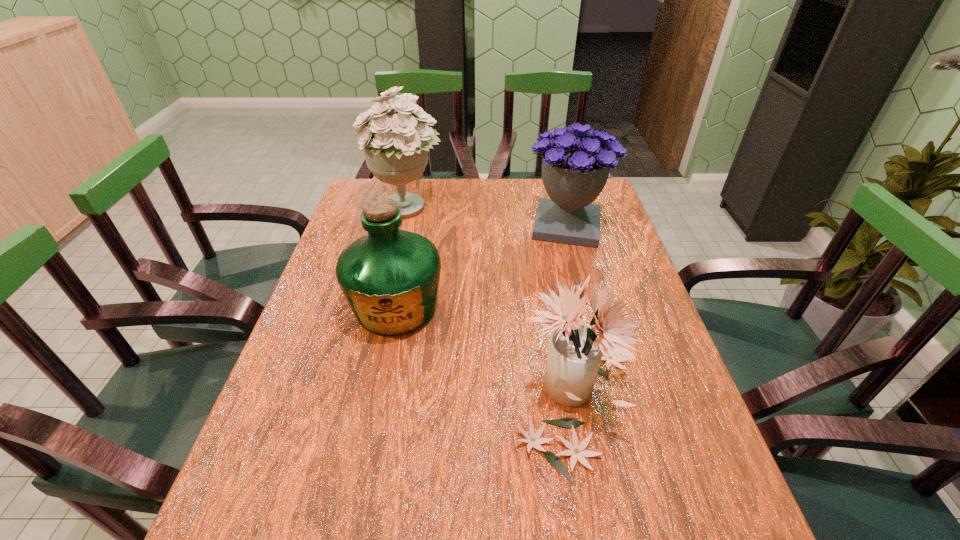
At what (x,y) coordinates should I click in order to perform the action: click on bouquet identified as the second closest to the shortest bouquet. Please return your answer as a coordinate pair (x, y). The height and width of the screenshot is (540, 960). Looking at the image, I should click on (395, 145).

This screenshot has width=960, height=540. What are the coordinates of `bouquet that stands as the second closest to the shortest bouquet` in the screenshot? It's located at (395, 145).